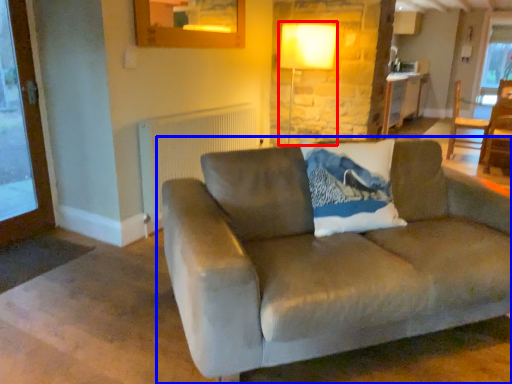
Question: Which of the following is the farthest to the observer, lamp (highlighted by a red box) or studio couch (highlighted by a blue box)?

Choices:
 (A) lamp
 (B) studio couch

Answer: (A)